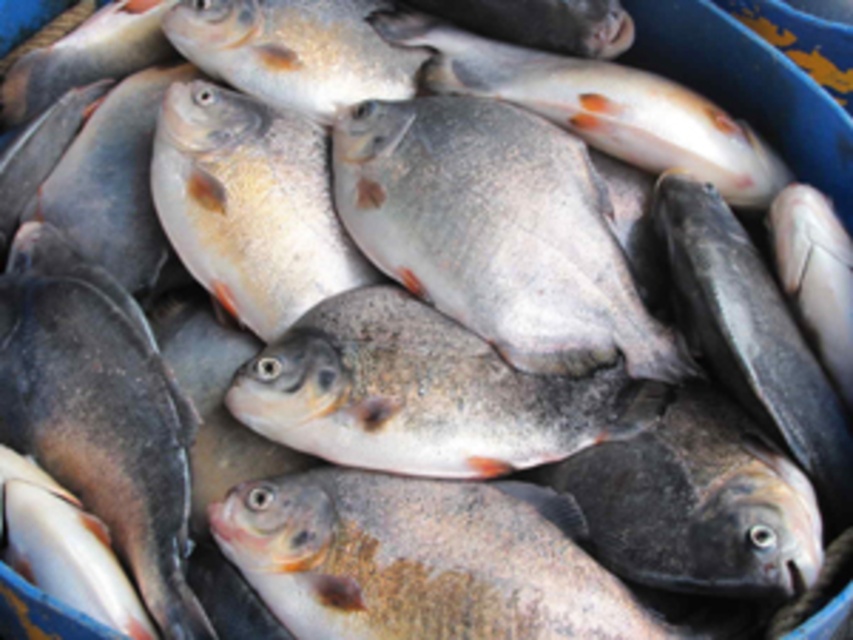
Does point (556, 220) come behind point (250, 394)?

Yes, it is behind point (250, 394).

Does shiny silver fish at center have a greater height compared to gray matte fish at center?

Yes, shiny silver fish at center is taller than gray matte fish at center.

Which is in front, point (525, 131) or point (335, 406)?

Point (335, 406)

The width and height of the screenshot is (853, 640). In order to click on shiny silver fish at center in this screenshot , I will do `click(497, 230)`.